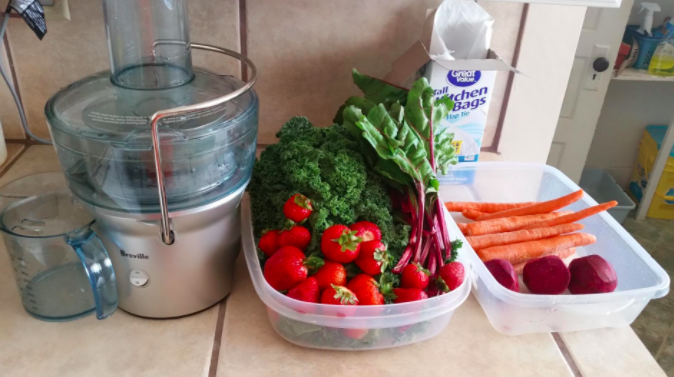
This screenshot has width=674, height=377. Find the location of `plastic storage bin`. plastic storage bin is located at coordinates (359, 312).